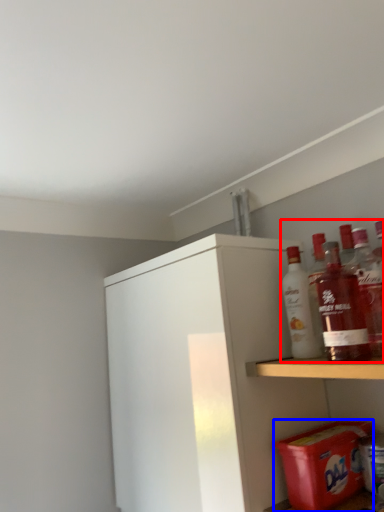
Question: Which object appears farthest to the camera in this image, beverage (highlighted by a red box) or carton (highlighted by a blue box)?

Choices:
 (A) beverage
 (B) carton

Answer: (B)